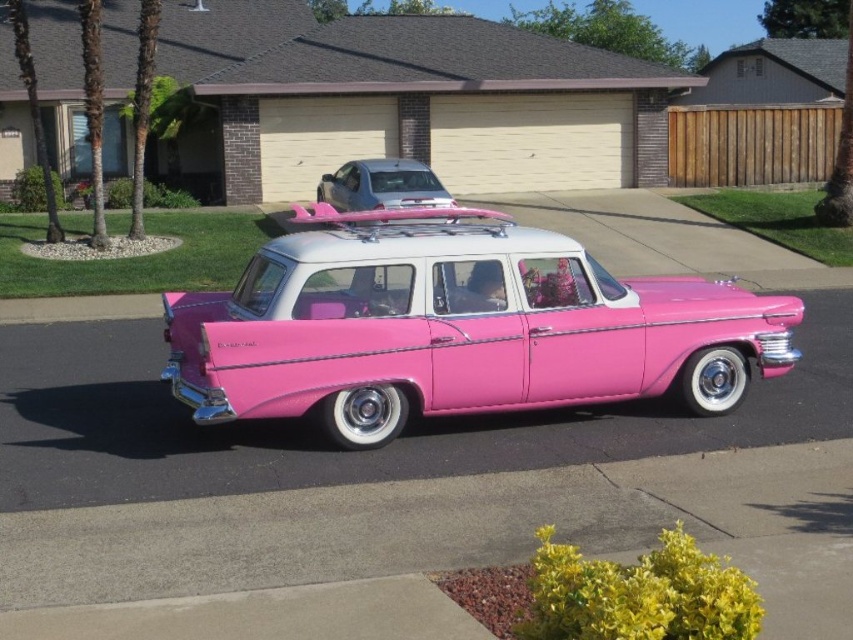
Where is `pink glossy station wagon at center`? This screenshot has height=640, width=853. pink glossy station wagon at center is located at coordinates (456, 326).

I want to click on pink glossy station wagon at center, so click(456, 326).

Which of these two, pink glossy car at center or pink glossy station wagon at center, stands taller?

With more height is pink glossy station wagon at center.

I want to click on pink glossy car at center, so click(387, 497).

Who is taller, pink glossy car at center or metallic silver minivan at upper center?

Standing taller between the two is metallic silver minivan at upper center.

Is pink glossy car at center bigger than metallic silver minivan at upper center?

Yes.

Is point (415, 589) farther from camera compared to point (438, 198)?

No, (415, 589) is in front of (438, 198).

Image resolution: width=853 pixels, height=640 pixels. Find the location of `pink glossy car at center`. pink glossy car at center is located at coordinates (387, 497).